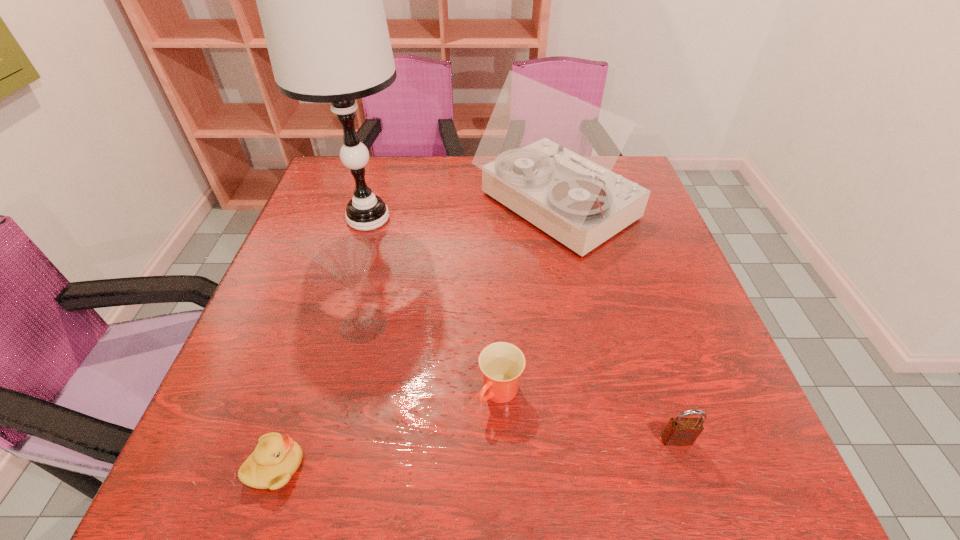
This screenshot has width=960, height=540. I want to click on the tallest object, so click(x=320, y=0).

Find the location of a particular element. The width and height of the screenshot is (960, 540). the fifth shortest object is located at coordinates (546, 155).

I want to click on flute glass, so click(x=345, y=260).

Identify the location of the fourth shortest object. The image size is (960, 540). (345, 260).

At what (x,y) coordinates should I click in order to perform the action: click on padlock. Please return your answer as a coordinate pair (x, y). The width and height of the screenshot is (960, 540). Looking at the image, I should click on (679, 431).

Identify the location of cup. (502, 363).

The height and width of the screenshot is (540, 960). Identify the location of duckling. (276, 458).

Locate an element on the screen. Image resolution: width=960 pixels, height=540 pixels. vacant space located 0.120m on the right of the table lamp is located at coordinates (460, 219).

I want to click on free spot located 0.220m on the front of the fifth shortest object, so (x=582, y=343).

The image size is (960, 540). I want to click on free space located 0.390m on the right of the flute glass, so click(x=581, y=325).